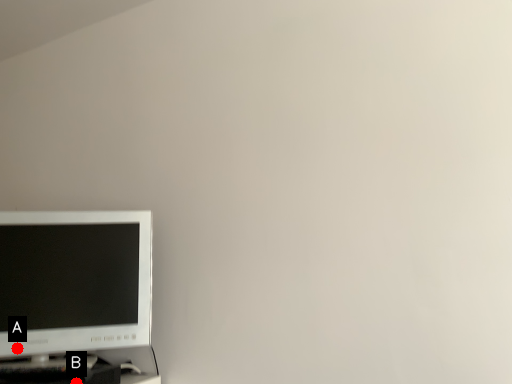
Question: Two points are circled on the image, labeled by A and B beside each circle. Among these points, which one is nearest to the camera?

Choices:
 (A) A is closer
 (B) B is closer

Answer: (B)